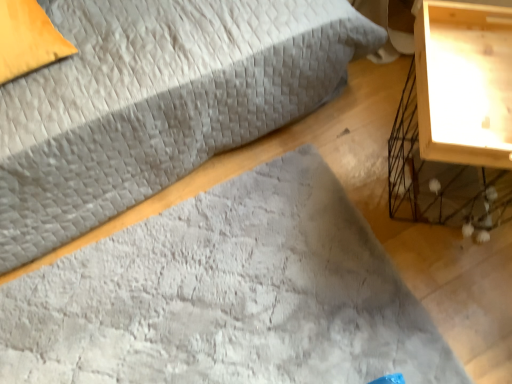
The image size is (512, 384). Identify the location of vacant space underneath textured gray mat at center (from a real-world perspective). (212, 294).